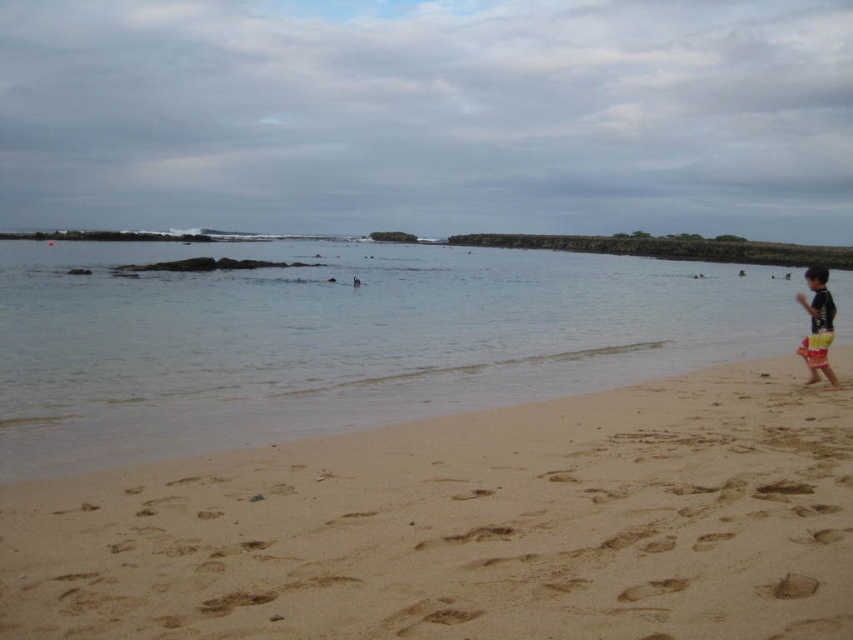
Does light brown sandy beach at lower right lie in front of black matte swimsuit at right?

Yes.

Can you confirm if light brown sandy beach at lower right is thinner than black matte swimsuit at right?

Yes, light brown sandy beach at lower right is thinner than black matte swimsuit at right.

Which is behind, point (677, 589) or point (811, 285)?

The point (811, 285) is more distant.

Locate an element on the screen. This screenshot has width=853, height=640. light brown sandy beach at lower right is located at coordinates tap(468, 525).

Looking at this image, is clear water at beach right smaller than black matte swimsuit at right?

Actually, clear water at beach right might be larger than black matte swimsuit at right.

Does clear water at beach right have a greater width compared to black matte swimsuit at right?

Yes.

Between point (579, 378) and point (811, 317), which one is positioned behind?

The point (579, 378) is more distant.

Find the location of a particular element. This screenshot has width=853, height=640. clear water at beach right is located at coordinates (340, 339).

Looking at this image, can you confirm if light brown sandy beach at lower right is positioned above clear water at beach right?

Incorrect, light brown sandy beach at lower right is not positioned above clear water at beach right.

Is point (194, 460) less distant than point (294, 291)?

Yes, it is in front of point (294, 291).

You are a GUI agent. You are given a task and a screenshot of the screen. Output one action in this format:
    pyautogui.click(x=<x>, y=<y>)
    Task: Click on the light brown sandy beach at lower right
    The image size is (853, 640).
    Given the screenshot: What is the action you would take?
    pyautogui.click(x=468, y=525)